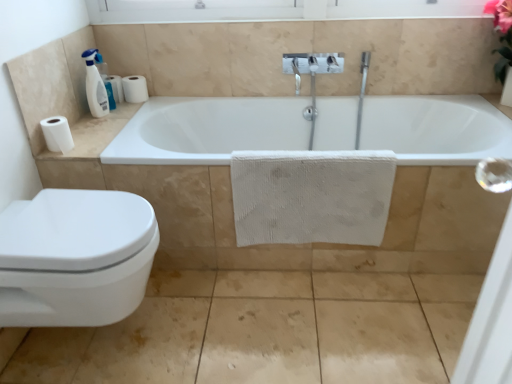
Where is `blank space situated above white matte paper towel at left (from a real-world perspective)`? This screenshot has height=384, width=512. blank space situated above white matte paper towel at left (from a real-world perspective) is located at coordinates (96, 124).